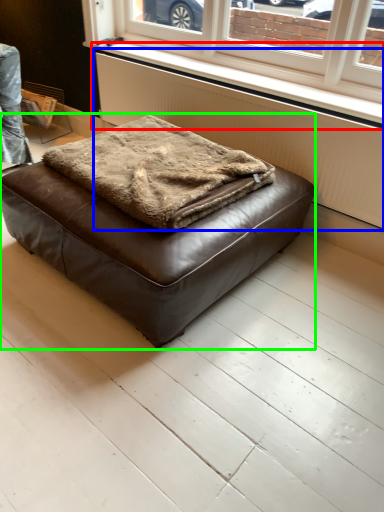
Question: Which object is positioned farthest from window sill (highlighted by a red box)? Select from radiator (highlighted by a blue box) and furniture (highlighted by a green box).

Choices:
 (A) radiator
 (B) furniture

Answer: (B)